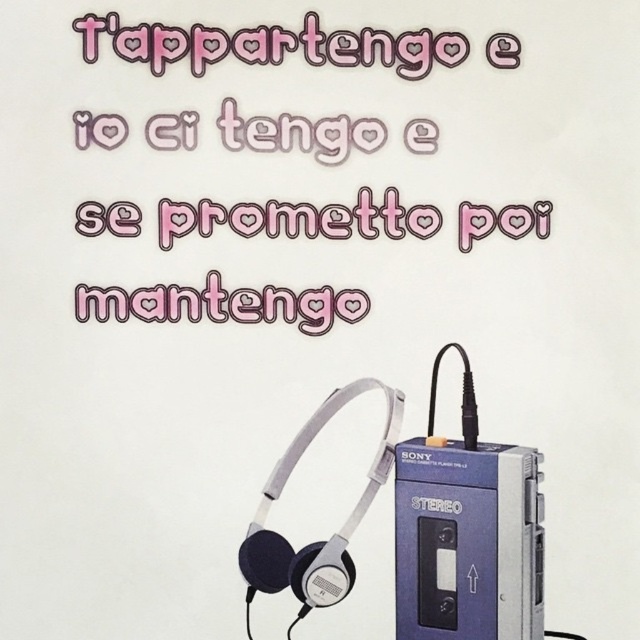
Which is in front, point (276, 116) or point (508, 561)?

Positioned in front is point (508, 561).

Can you confirm if pink paper text at upper center is smaller than blue plastic cassette at lower right?

Incorrect, pink paper text at upper center is not smaller in size than blue plastic cassette at lower right.

Which is behind, point (125, 132) or point (465, 525)?

The point (125, 132) is behind.

Where is `pink paper text at upper center`? The height and width of the screenshot is (640, 640). pink paper text at upper center is located at coordinates (273, 44).